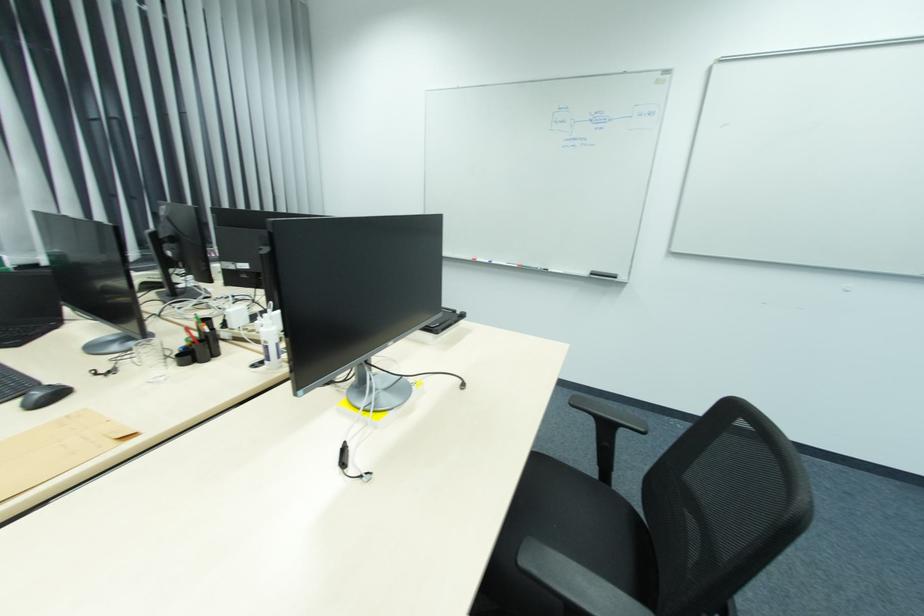
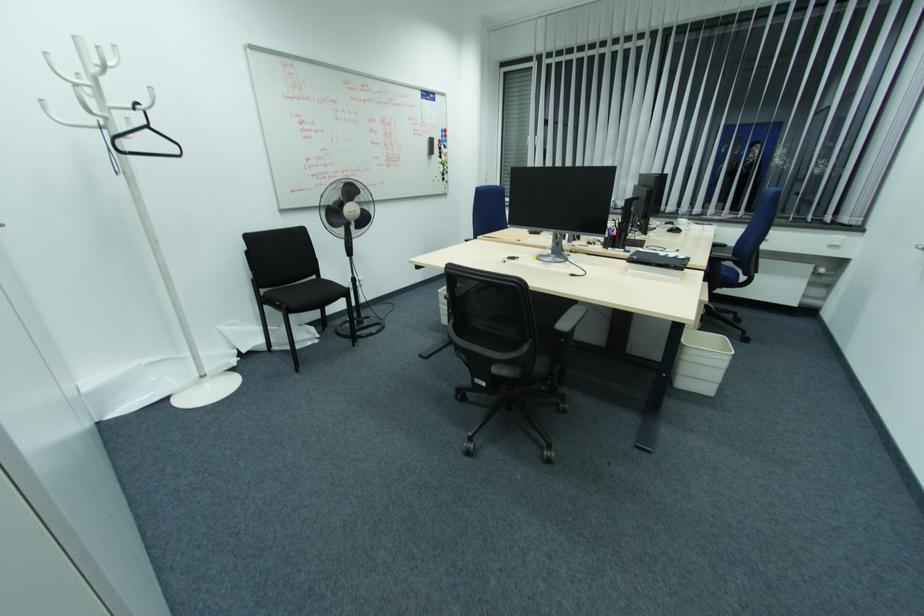
Find the pixel in the second image that matches [439,325] in the first image.

(638, 257)